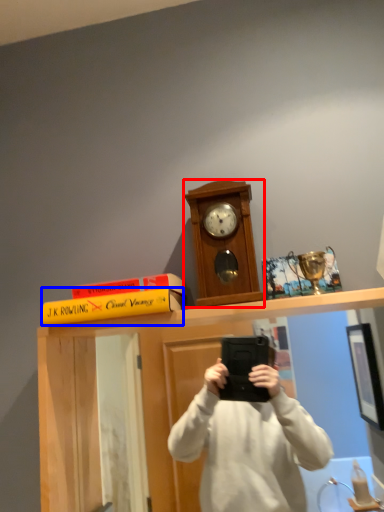
Question: Among these objects, which one is nearest to the camera, clock (highlighted by a red box) or book (highlighted by a blue box)?

Choices:
 (A) clock
 (B) book

Answer: (B)